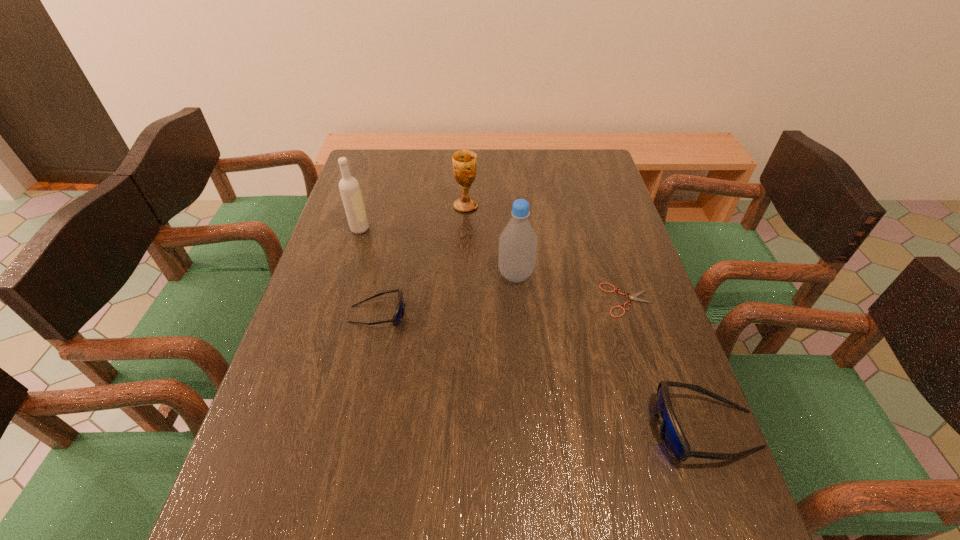
Where is `empty space that is in between the shortest object and the farther sunglasses`? The height and width of the screenshot is (540, 960). empty space that is in between the shortest object and the farther sunglasses is located at coordinates (502, 307).

Image resolution: width=960 pixels, height=540 pixels. In order to click on empty location between the chalice and the right sunglasses in this screenshot , I will do `click(586, 318)`.

The image size is (960, 540). In order to click on unoccupied area between the nearer sunglasses and the chalice in this screenshot , I will do `click(586, 318)`.

The image size is (960, 540). What are the coordinates of `vacant area that lies between the nearest object and the second shortest object` in the screenshot? It's located at click(x=541, y=372).

Identify the location of vacant space that is in between the nearest object and the shortest object. Image resolution: width=960 pixels, height=540 pixels. [666, 364].

In order to click on vacant area between the shorter sunglasses and the vodka in this screenshot , I will do `click(369, 272)`.

Find the location of a particular element. free point between the fifth object from right to left and the fourth object from left to right is located at coordinates (446, 294).

This screenshot has height=540, width=960. What are the coordinates of `vacant area between the shears and the taller sunglasses` in the screenshot? It's located at (666, 364).

Find the location of a particular element. This screenshot has width=960, height=540. object that stands as the second closest to the shorter sunglasses is located at coordinates (349, 187).

Select which object is the fifth closest to the third shortest object. Please provide its 2D coordinates. Your answer should be formatted as a tuple, i.e. [(x, y)], where the tuple contains the x and y coordinates of a point satisfying the conditions above.

[(349, 187)]